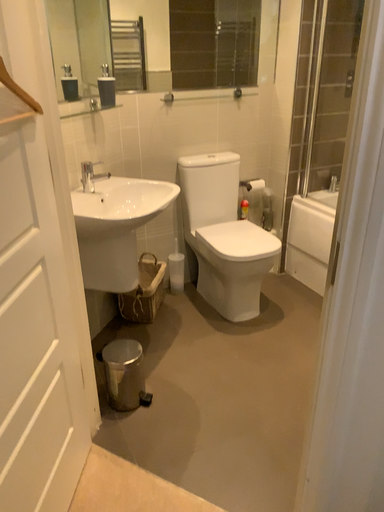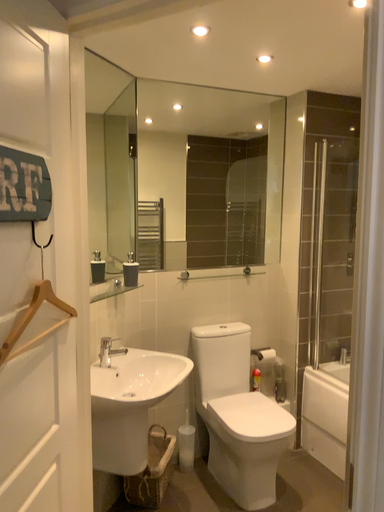
Question: Which way did the camera rotate in the video?

Choices:
 (A) rotated downward
 (B) rotated upward

Answer: (B)